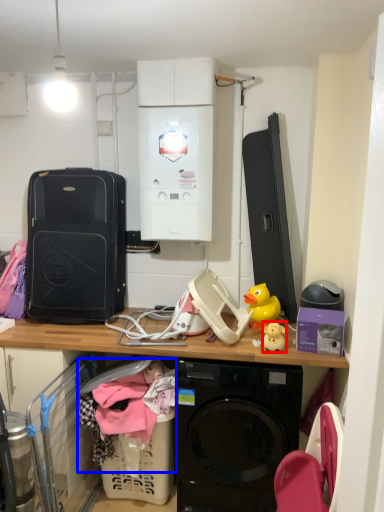
Question: Which point is further to the camera, toy (highlighted by a red box) or clothing (highlighted by a blue box)?

Choices:
 (A) toy
 (B) clothing

Answer: (A)